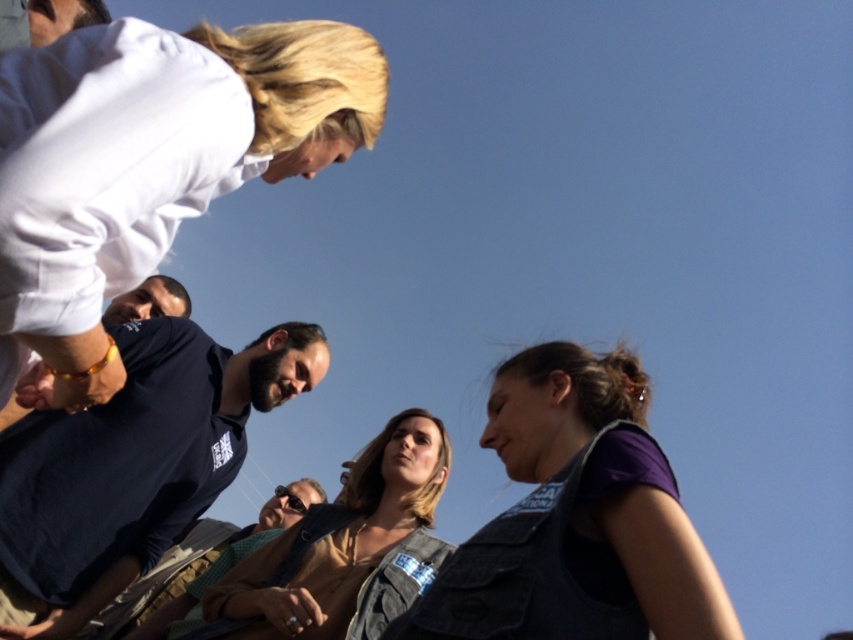
You are a photographer trying to capture the entire scene of the denim vest at lower right and dark brown hair at upper right in one shot. Based on their sizes, which object should you focus on to ensure both are in frame without cropping?

The denim vest at lower right is larger in size compared to the dark brown hair at upper right. To capture both in one shot without cropping, focus on the denim vest at lower right as it takes up more space in the frame, allowing the smaller dark brown hair at upper right to be included naturally.